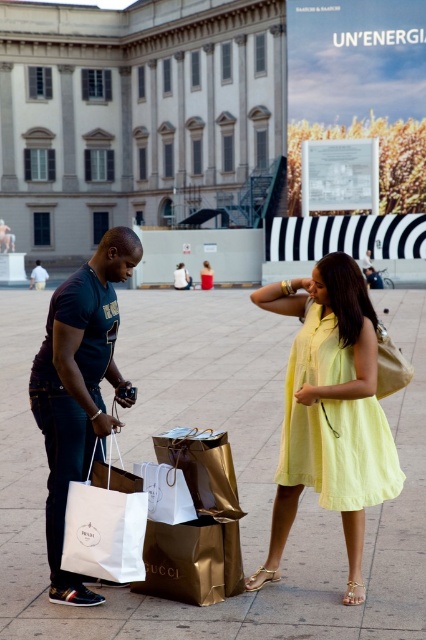
Question: Estimate the real-world distances between objects in this image. Which object is closer to the lemon yellow fabric dress at center?

Choices:
 (A) white canvas bag at lower left
 (B) gold metallic shopping bag at center

Answer: (B)

Question: Which point is farther to the camera?

Choices:
 (A) (204, 378)
 (B) (210, 276)

Answer: (B)

Question: Can you confirm if light yellow cotton dress at center is positioned below white canvas bag at lower left?

Choices:
 (A) no
 (B) yes

Answer: (A)

Question: Is the position of lemon yellow fabric dress at center more distant than that of white paper bag at lower left?

Choices:
 (A) no
 (B) yes

Answer: (A)

Question: Is gold metallic shopping bag at center to the left of white paper bag at lower left from the viewer's perspective?

Choices:
 (A) no
 (B) yes

Answer: (A)

Question: Which point is farther to the camera?

Choices:
 (A) (192, 436)
 (B) (209, 273)
 (C) (284, 419)

Answer: (B)